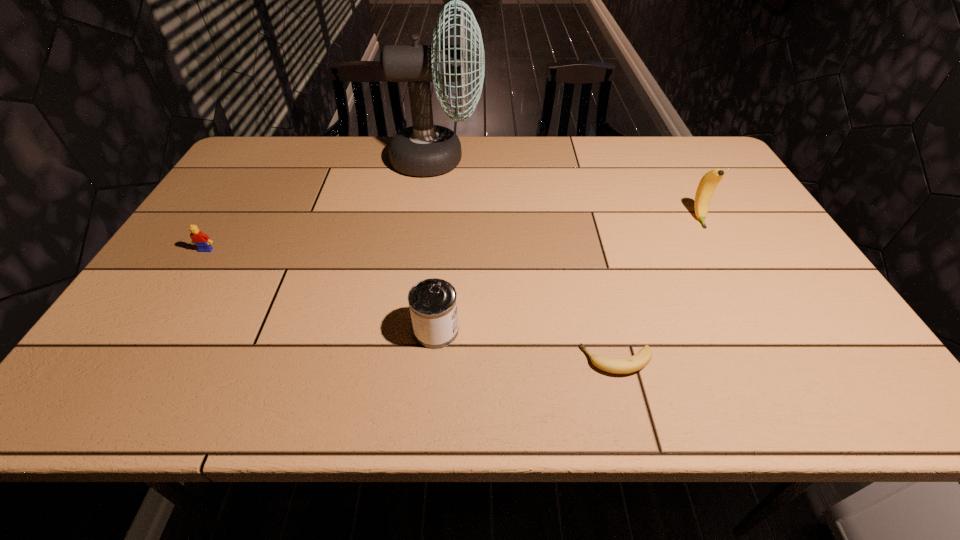
Locate an element on the screen. The height and width of the screenshot is (540, 960). vacant space in between the farther banana and the fourth tallest object is located at coordinates (452, 234).

This screenshot has width=960, height=540. In order to click on free point between the fan and the second object from right to left in this screenshot , I will do `click(527, 260)`.

The image size is (960, 540). Find the location of `free space between the Lego and the farther banana`. free space between the Lego and the farther banana is located at coordinates (452, 234).

Identify the location of free space between the third shortest object and the shorter banana. The width and height of the screenshot is (960, 540). (526, 346).

Point out which object is positioned as the second nearest to the fourth tallest object. Please provide its 2D coordinates. Your answer should be formatted as a tuple, i.e. [(x, y)], where the tuple contains the x and y coordinates of a point satisfying the conditions above.

[(432, 302)]

Where is `object that is the third closest one to the farthest object`? This screenshot has height=540, width=960. object that is the third closest one to the farthest object is located at coordinates (707, 185).

Where is `free spot that satisfies the following two spatial constraints: 1. on the face of the Lego; 2. on the left side of the third shortest object`? This screenshot has height=540, width=960. free spot that satisfies the following two spatial constraints: 1. on the face of the Lego; 2. on the left side of the third shortest object is located at coordinates (156, 330).

In order to click on free point that satisfies the following two spatial constraints: 1. on the back side of the third shortest object; 2. in front of the tallest object where the airflow is directed in this screenshot , I will do `click(451, 159)`.

The image size is (960, 540). In order to click on free space that satisfies the following two spatial constraints: 1. in front of the tallest object where the airflow is directed; 2. on the face of the Lego in this screenshot , I will do `click(426, 250)`.

The image size is (960, 540). In order to click on free spot that satisfies the following two spatial constraints: 1. in front of the fan where the airflow is directed; 2. on the face of the third farthest object in this screenshot , I will do `click(426, 250)`.